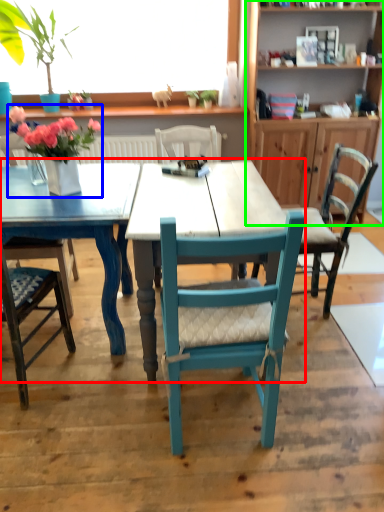
Question: Estimate the real-world distances between objects in this image. Which object is farther from kitchen & dining room table (highlighted by a red box), floral arrangement (highlighted by a blue box) or cabinetry (highlighted by a green box)?

Choices:
 (A) floral arrangement
 (B) cabinetry

Answer: (B)